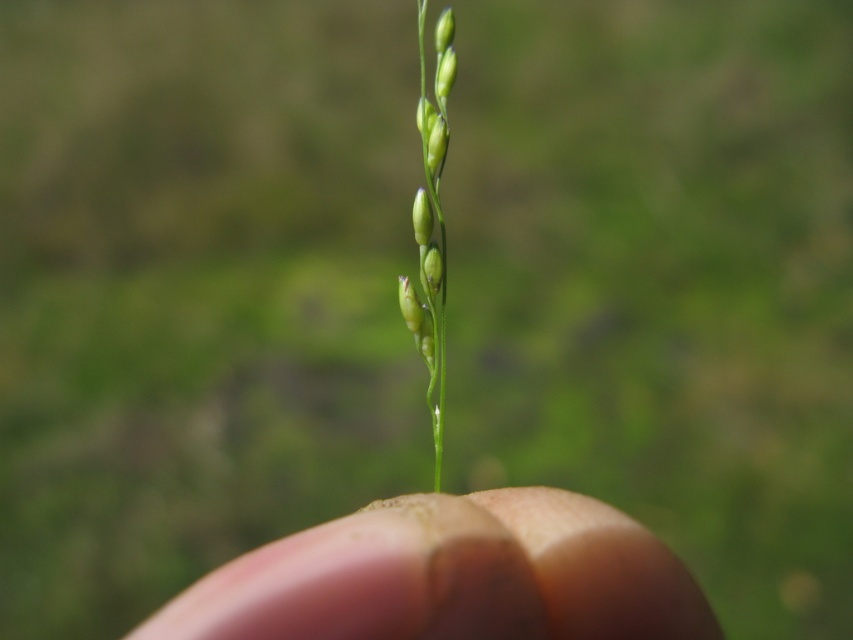
Does flesh-toned skin at center lie behind green matte grass at center?

No, it is not.

How much distance is there between flesh-toned skin at center and green matte grass at center?

flesh-toned skin at center is 9.23 inches from green matte grass at center.

Between point (415, 552) and point (439, 218), which one is positioned behind?

The point (439, 218) is behind.

The width and height of the screenshot is (853, 640). Identify the location of flesh-toned skin at center. (451, 577).